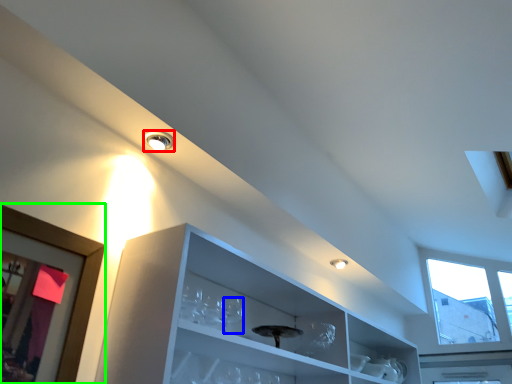
Question: Which object is the farthest from droplight (highlighted by a red box)? Choose among these: wine glass (highlighted by a blue box) or picture frame (highlighted by a green box).

Choices:
 (A) wine glass
 (B) picture frame

Answer: (A)